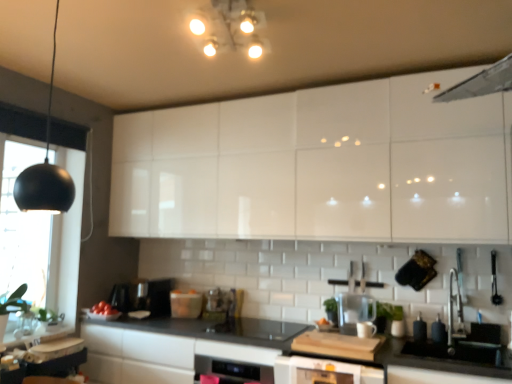
Question: Can we say matte plastic container at center, acting as the 2th appliance starting from the back, lies outside matte black soap dispenser at lower right, which is the 1th appliance in right-to-left order?

Choices:
 (A) no
 (B) yes

Answer: (B)

Question: Is matte plastic container at center, the third appliance from the front, positioned in front of matte black soap dispenser at lower right, which is the fourth appliance from left to right?

Choices:
 (A) no
 (B) yes

Answer: (A)

Question: Is matte plastic container at center, the fourth appliance when ordered from right to left, at the right side of matte black soap dispenser at lower right, the fourth appliance positioned from the back?

Choices:
 (A) no
 (B) yes

Answer: (A)

Question: From the image's perspective, is matte plastic container at center, positioned as the 1th appliance in left-to-right order, beneath matte black soap dispenser at lower right, which is the 1th appliance in right-to-left order?

Choices:
 (A) no
 (B) yes

Answer: (B)

Question: Does matte plastic container at center, acting as the 2th appliance starting from the back, have a greater width compared to matte black soap dispenser at lower right, placed as the first appliance when sorted from front to back?

Choices:
 (A) no
 (B) yes

Answer: (B)

Question: In terms of width, does black matte lampshade at left look wider or thinner when compared to satin black coffee machine at center?

Choices:
 (A) thin
 (B) wide

Answer: (A)

Question: Is black matte lampshade at left bigger or smaller than satin black coffee machine at center?

Choices:
 (A) big
 (B) small

Answer: (A)

Question: From a real-world perspective, is black matte lampshade at left above or below satin black coffee machine at center?

Choices:
 (A) above
 (B) below

Answer: (A)

Question: From the image's perspective, is black matte lampshade at left above or below satin black coffee machine at center?

Choices:
 (A) above
 (B) below

Answer: (A)

Question: Is black matte light fixture at left, the 1th light fixture from the left, inside the boundaries of matte plastic container at center, the fourth appliance when ordered from right to left, or outside?

Choices:
 (A) inside
 (B) outside

Answer: (B)

Question: From a real-world perspective, relative to matte plastic container at center, acting as the 2th appliance starting from the back, is black matte light fixture at left, the 1th light fixture from the left, vertically above or below?

Choices:
 (A) below
 (B) above

Answer: (B)

Question: In terms of height, does black matte light fixture at left, the 2th light fixture in the top-to-bottom sequence, look taller or shorter compared to matte plastic container at center, positioned as the 1th appliance in left-to-right order?

Choices:
 (A) short
 (B) tall

Answer: (B)

Question: Considering the positions of black matte light fixture at left, positioned as the 2th light fixture in right-to-left order, and matte plastic container at center, positioned as the 1th appliance in left-to-right order, in the image, is black matte light fixture at left, positioned as the 2th light fixture in right-to-left order, wider or thinner than matte plastic container at center, positioned as the 1th appliance in left-to-right order,?

Choices:
 (A) wide
 (B) thin

Answer: (B)

Question: Do you think black matte countertop at center is within matte plastic container at center, positioned as the 1th appliance in left-to-right order, or outside of it?

Choices:
 (A) inside
 (B) outside

Answer: (B)

Question: From a real-world perspective, is black matte countertop at center above or below matte plastic container at center, the fourth appliance when ordered from right to left?

Choices:
 (A) above
 (B) below

Answer: (B)